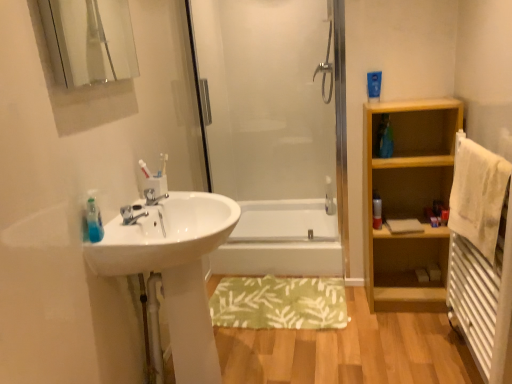
Question: Could you tell me if clear glass mirror at upper left is facing white glossy bathtub at center?

Choices:
 (A) yes
 (B) no

Answer: (B)

Question: Does clear glass mirror at upper left contain white glossy bathtub at center?

Choices:
 (A) no
 (B) yes

Answer: (A)

Question: Is clear glass mirror at upper left looking in the opposite direction of white glossy bathtub at center?

Choices:
 (A) yes
 (B) no

Answer: (B)

Question: Is clear glass mirror at upper left beside white glossy bathtub at center?

Choices:
 (A) yes
 (B) no

Answer: (B)

Question: From a real-world perspective, is clear glass mirror at upper left below white glossy bathtub at center?

Choices:
 (A) no
 (B) yes

Answer: (A)

Question: Is light wood shelf at right wider or thinner than white textured radiator at right?

Choices:
 (A) thin
 (B) wide

Answer: (B)

Question: Considering the positions of point (434, 110) and point (458, 301), is point (434, 110) closer or farther from the camera than point (458, 301)?

Choices:
 (A) closer
 (B) farther

Answer: (B)

Question: In the image, is light wood shelf at right positioned in front of or behind white textured radiator at right?

Choices:
 (A) behind
 (B) front

Answer: (A)

Question: From a real-world perspective, relative to white textured radiator at right, is light wood shelf at right vertically above or below?

Choices:
 (A) below
 (B) above

Answer: (B)

Question: In terms of size, does green fabric bath mat at center appear bigger or smaller than light wood shelf at right?

Choices:
 (A) big
 (B) small

Answer: (B)

Question: Relative to light wood shelf at right, is green fabric bath mat at center in front or behind?

Choices:
 (A) behind
 (B) front

Answer: (A)

Question: Considering the positions of green fabric bath mat at center and light wood shelf at right in the image, is green fabric bath mat at center wider or thinner than light wood shelf at right?

Choices:
 (A) thin
 (B) wide

Answer: (B)

Question: From a real-world perspective, is green fabric bath mat at center above or below light wood shelf at right?

Choices:
 (A) below
 (B) above

Answer: (A)

Question: Is white soft towel at right bigger or smaller than white plastic bottle at right?

Choices:
 (A) small
 (B) big

Answer: (B)

Question: Is white soft towel at right taller or shorter than white plastic bottle at right?

Choices:
 (A) short
 (B) tall

Answer: (B)